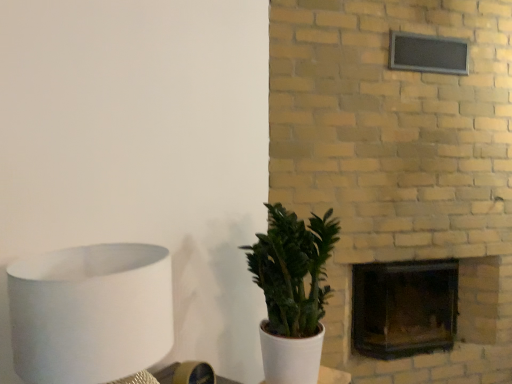
Question: From a real-world perspective, is white matte lampshade at left beneath green matte plant at center?

Choices:
 (A) yes
 (B) no

Answer: (B)

Question: From the image's perspective, is white matte lampshade at left above green matte plant at center?

Choices:
 (A) yes
 (B) no

Answer: (A)

Question: Is green matte plant at center located within white matte lampshade at left?

Choices:
 (A) no
 (B) yes

Answer: (A)

Question: From a real-world perspective, does white matte lampshade at left stand above green matte plant at center?

Choices:
 (A) yes
 (B) no

Answer: (A)

Question: Is white matte lampshade at left bigger than green matte plant at center?

Choices:
 (A) yes
 (B) no

Answer: (B)

Question: In the image, is white matte lampshade at left on the left side or the right side of green matte plant at center?

Choices:
 (A) left
 (B) right

Answer: (A)

Question: Looking at their shapes, would you say white matte lampshade at left is wider or thinner than green matte plant at center?

Choices:
 (A) thin
 (B) wide

Answer: (A)

Question: Choose the correct answer: Is white matte lampshade at left inside green matte plant at center or outside it?

Choices:
 (A) outside
 (B) inside

Answer: (A)

Question: Looking at the image, does white matte lampshade at left seem bigger or smaller compared to green matte plant at center?

Choices:
 (A) big
 (B) small

Answer: (B)

Question: From their relative heights in the image, would you say black glass fireplace at center-right is taller or shorter than green matte plant at center?

Choices:
 (A) short
 (B) tall

Answer: (A)

Question: From a real-world perspective, is black glass fireplace at center-right positioned above or below green matte plant at center?

Choices:
 (A) below
 (B) above

Answer: (A)

Question: From the image's perspective, is black glass fireplace at center-right positioned above or below green matte plant at center?

Choices:
 (A) above
 (B) below

Answer: (B)

Question: Which is correct: black glass fireplace at center-right is inside green matte plant at center, or outside of it?

Choices:
 (A) inside
 (B) outside

Answer: (B)

Question: Is green matte plant at center inside or outside of white matte lampshade at left?

Choices:
 (A) outside
 (B) inside

Answer: (A)

Question: Is point (290, 256) closer or farther from the camera than point (153, 329)?

Choices:
 (A) closer
 (B) farther

Answer: (B)